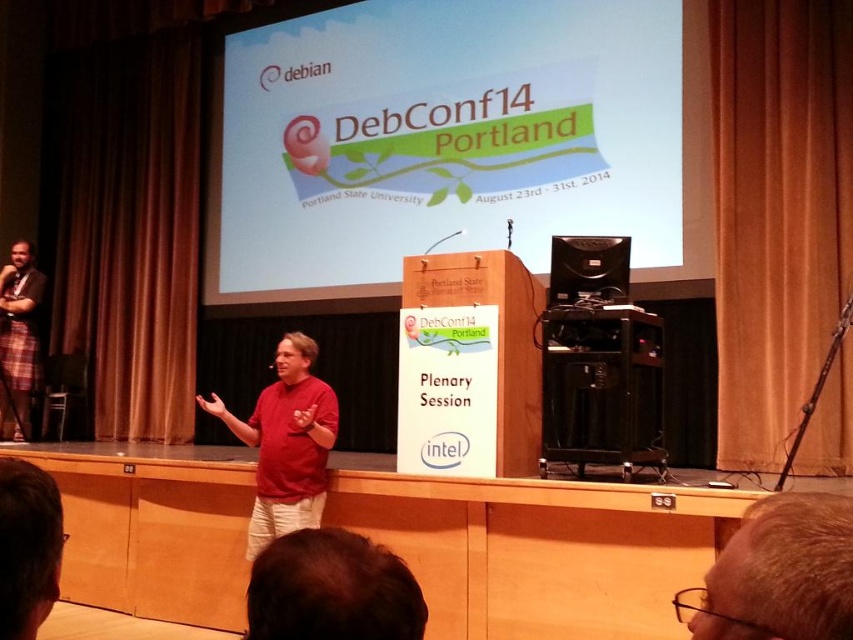
Is matte wooden podium at center further to camera compared to light brown hair at lower right?

Yes, it is behind light brown hair at lower right.

Can you confirm if matte wooden podium at center is thinner than light brown hair at lower right?

No, matte wooden podium at center is not thinner than light brown hair at lower right.

Between point (465, 141) and point (785, 524), which one is positioned in front?

Point (785, 524)

Where is `matte wooden podium at center`? This screenshot has height=640, width=853. matte wooden podium at center is located at coordinates (442, 138).

Image resolution: width=853 pixels, height=640 pixels. What do you see at coordinates (286, 442) in the screenshot?
I see `matte red shirt at center` at bounding box center [286, 442].

Which is below, matte red shirt at center or black plastic speaker at center?

matte red shirt at center

What are the coordinates of `matte red shirt at center` in the screenshot? It's located at pyautogui.click(x=286, y=442).

Is light brown hair at lower right smaller than plaid fabric at left?

Yes, light brown hair at lower right is smaller than plaid fabric at left.

Between light brown hair at lower right and plaid fabric at left, which one appears on the left side from the viewer's perspective?

Positioned to the left is plaid fabric at left.

This screenshot has height=640, width=853. I want to click on light brown hair at lower right, so click(778, 573).

I want to click on light brown hair at lower right, so click(x=778, y=573).